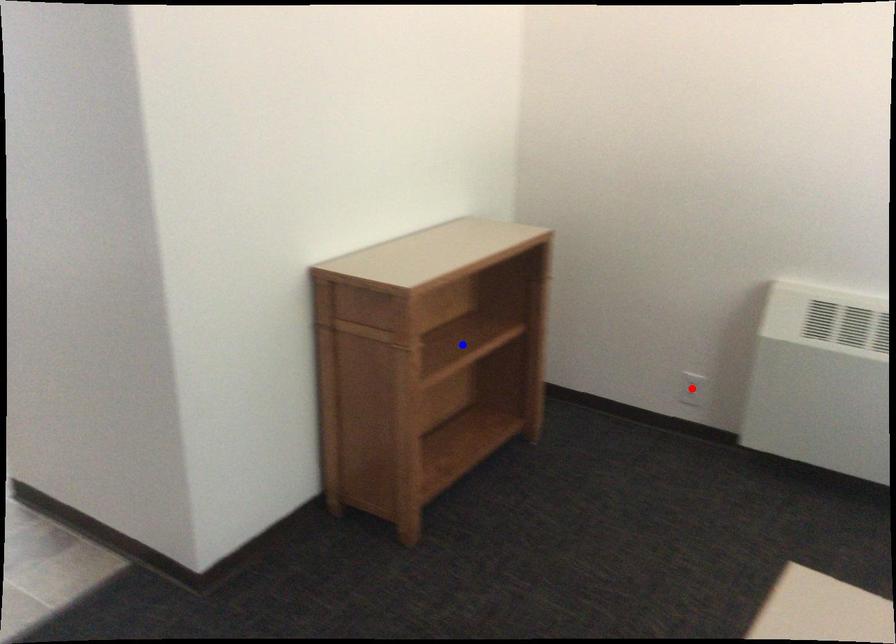
Question: In the image, two points are highlighted. Which point is nearer to the camera? Reply with the corresponding letter.

Choices:
 (A) blue point
 (B) red point

Answer: (A)